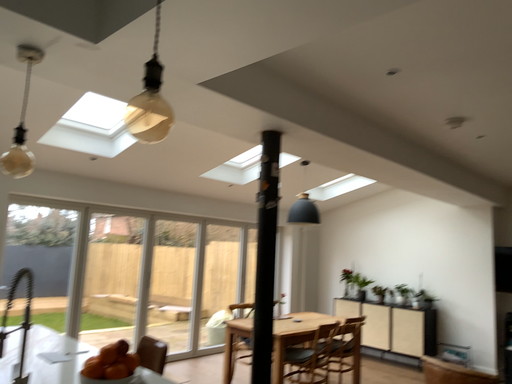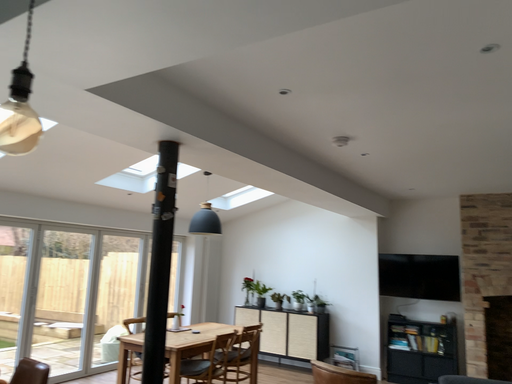
Question: Which way did the camera rotate in the video?

Choices:
 (A) rotated left
 (B) rotated right

Answer: (B)